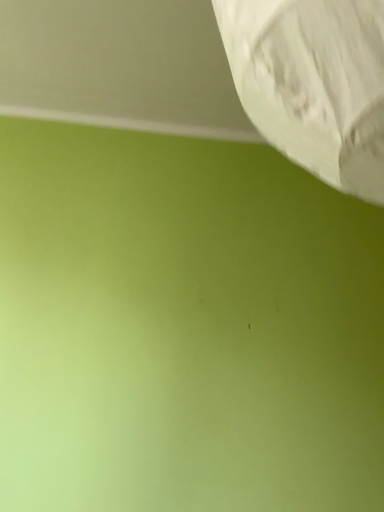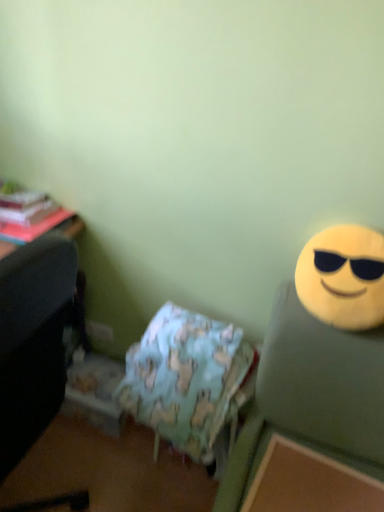
Question: How did the camera likely rotate when shooting the video?

Choices:
 (A) rotated downward
 (B) rotated upward

Answer: (A)